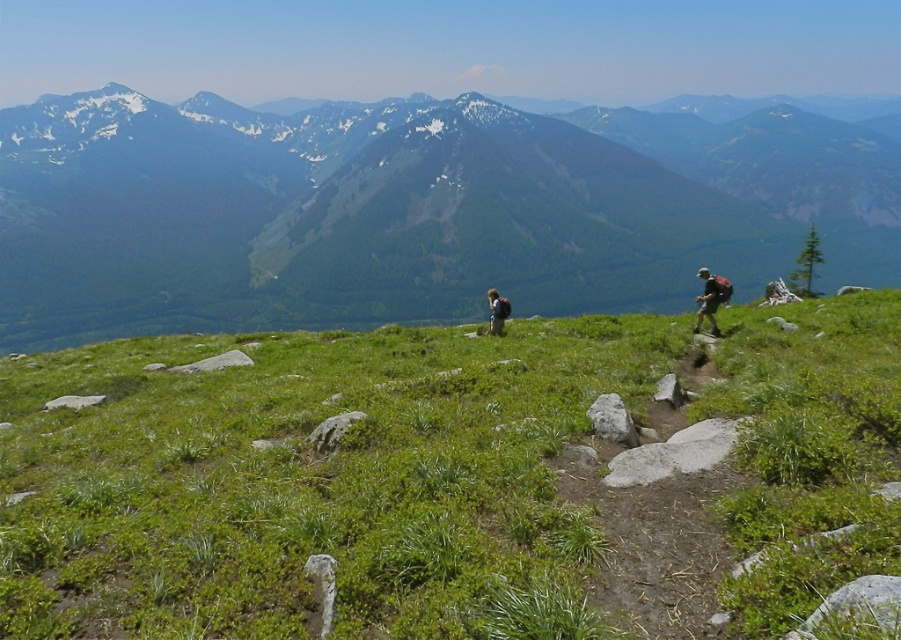
Is green grassy at center positioned before green fabric backpack at center?

Yes.

Does green grassy at center have a larger size compared to green fabric backpack at center?

Correct, green grassy at center is larger in size than green fabric backpack at center.

Measure the distance between point (x=465, y=621) and camera.

Point (x=465, y=621) is 5.41 meters away from camera.

I want to click on green grassy at center, so click(x=314, y=483).

Is dark gray backpack at right above green fabric backpack at center?

Indeed, dark gray backpack at right is positioned over green fabric backpack at center.

Is dark gray backpack at right bigger than green fabric backpack at center?

Yes, dark gray backpack at right is bigger than green fabric backpack at center.

Is point (712, 321) less distant than point (488, 298)?

Yes, it is in front of point (488, 298).

The image size is (901, 640). What are the coordinates of `dark gray backpack at right` in the screenshot? It's located at (710, 298).

Is point (623, 266) farther from viewer compared to point (497, 333)?

Yes, point (623, 266) is farther from viewer.

Does green grassy hillside at center have a greater width compared to green fabric backpack at center?

Indeed, green grassy hillside at center has a greater width compared to green fabric backpack at center.

Is point (435, 138) farther from viewer compared to point (489, 298)?

That is True.

Locate an element on the screen. green grassy hillside at center is located at coordinates (407, 209).